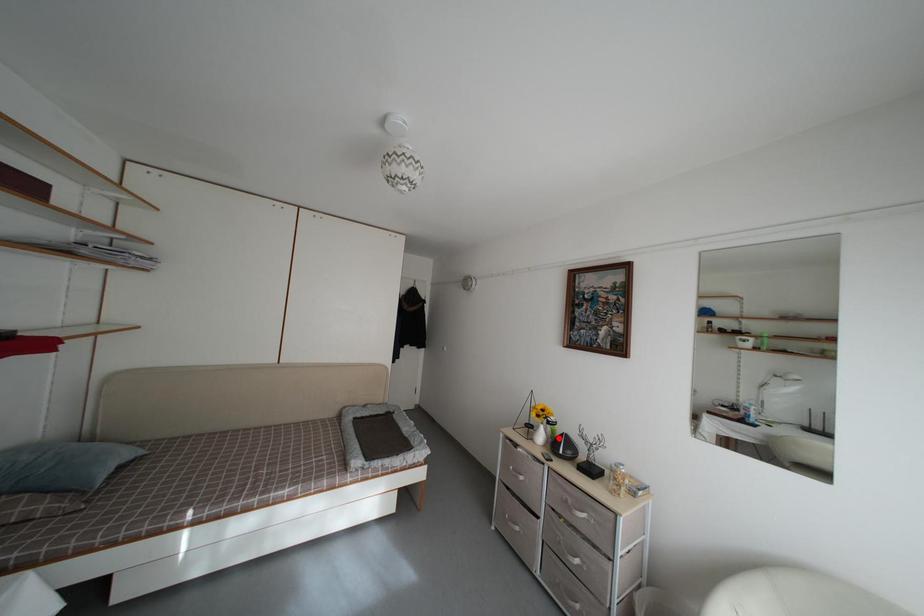
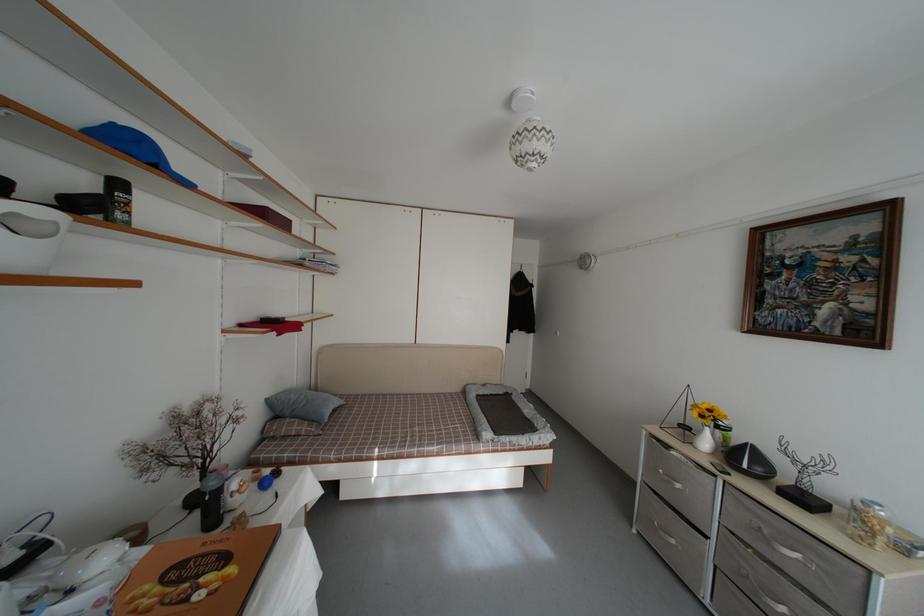
Where in the second image is the point corresponding to the highlighted location from the first image?

(731, 446)